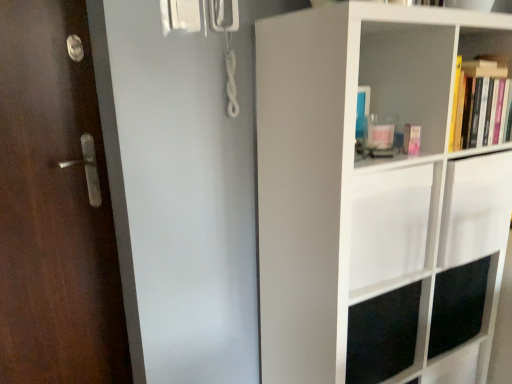
Question: Is dark wood door at left positioned far away from hardcover books at upper right, positioned as the 1th shelf in top-to-bottom order?

Choices:
 (A) no
 (B) yes

Answer: (B)

Question: Does dark wood door at left come behind hardcover books at upper right, positioned as the 1th shelf in top-to-bottom order?

Choices:
 (A) no
 (B) yes

Answer: (A)

Question: Considering the relative sizes of dark wood door at left and hardcover books at upper right, positioned as the 2th shelf in bottom-to-top order, in the image provided, is dark wood door at left shorter than hardcover books at upper right, positioned as the 2th shelf in bottom-to-top order,?

Choices:
 (A) yes
 (B) no

Answer: (B)

Question: From a real-world perspective, is dark wood door at left below hardcover books at upper right, positioned as the 1th shelf in top-to-bottom order?

Choices:
 (A) no
 (B) yes

Answer: (B)

Question: From the image's perspective, is dark wood door at left on hardcover books at upper right, positioned as the 2th shelf in bottom-to-top order?

Choices:
 (A) yes
 (B) no

Answer: (B)

Question: From a real-world perspective, is dark wood door at left positioned above or below white matte shelf at right, which ranks as the 1th shelf in bottom-to-top order?

Choices:
 (A) above
 (B) below

Answer: (A)

Question: Choose the correct answer: Is dark wood door at left inside white matte shelf at right, positioned as the second shelf in top-to-bottom order, or outside it?

Choices:
 (A) outside
 (B) inside

Answer: (A)

Question: Is dark wood door at left taller or shorter than white matte shelf at right, positioned as the second shelf in top-to-bottom order?

Choices:
 (A) tall
 (B) short

Answer: (B)

Question: Relative to white matte shelf at right, positioned as the second shelf in top-to-bottom order, is dark wood door at left in front or behind?

Choices:
 (A) behind
 (B) front

Answer: (A)

Question: From the image's perspective, is dark wood door at left located above or below hardcover books at upper right, positioned as the 2th shelf in bottom-to-top order?

Choices:
 (A) above
 (B) below

Answer: (B)

Question: Would you say dark wood door at left is to the left or to the right of hardcover books at upper right, positioned as the 2th shelf in bottom-to-top order, in the picture?

Choices:
 (A) right
 (B) left

Answer: (B)

Question: Does point (4, 114) appear closer or farther from the camera than point (459, 46)?

Choices:
 (A) farther
 (B) closer

Answer: (B)

Question: In terms of height, does dark wood door at left look taller or shorter compared to hardcover books at upper right, positioned as the 2th shelf in bottom-to-top order?

Choices:
 (A) short
 (B) tall

Answer: (B)

Question: Considering the positions of white matte shelf at right, which ranks as the 1th shelf in bottom-to-top order, and hardcover books at upper right, positioned as the 2th shelf in bottom-to-top order, in the image, is white matte shelf at right, which ranks as the 1th shelf in bottom-to-top order, taller or shorter than hardcover books at upper right, positioned as the 2th shelf in bottom-to-top order,?

Choices:
 (A) short
 (B) tall

Answer: (B)

Question: Looking at their shapes, would you say white matte shelf at right, which ranks as the 1th shelf in bottom-to-top order, is wider or thinner than hardcover books at upper right, positioned as the 1th shelf in top-to-bottom order?

Choices:
 (A) wide
 (B) thin

Answer: (A)